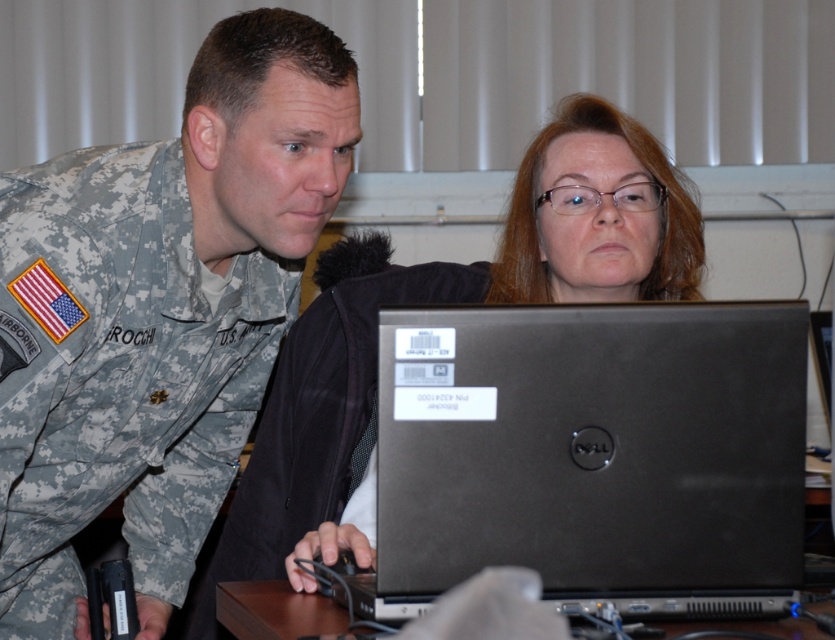
Question: Estimate the real-world distances between objects in this image. Which object is farther from the black matte laptop at center?

Choices:
 (A) brown wooden table at lower center
 (B) matte black laptop at center

Answer: (B)

Question: Which object appears closest to the camera in this image?

Choices:
 (A) camouflage uniform at left
 (B) brown wooden table at lower center
 (C) black matte laptop at center
 (D) matte black laptop at center

Answer: (C)

Question: Which is nearer to the black matte laptop at center?

Choices:
 (A) brown wooden table at lower center
 (B) matte black laptop at center

Answer: (A)

Question: Is black matte laptop at center closer to the viewer compared to brown wooden table at lower center?

Choices:
 (A) yes
 (B) no

Answer: (A)

Question: Is matte black laptop at center to the right of brown wooden table at lower center from the viewer's perspective?

Choices:
 (A) no
 (B) yes

Answer: (B)

Question: Does black matte laptop at center come behind brown wooden table at lower center?

Choices:
 (A) yes
 (B) no

Answer: (B)